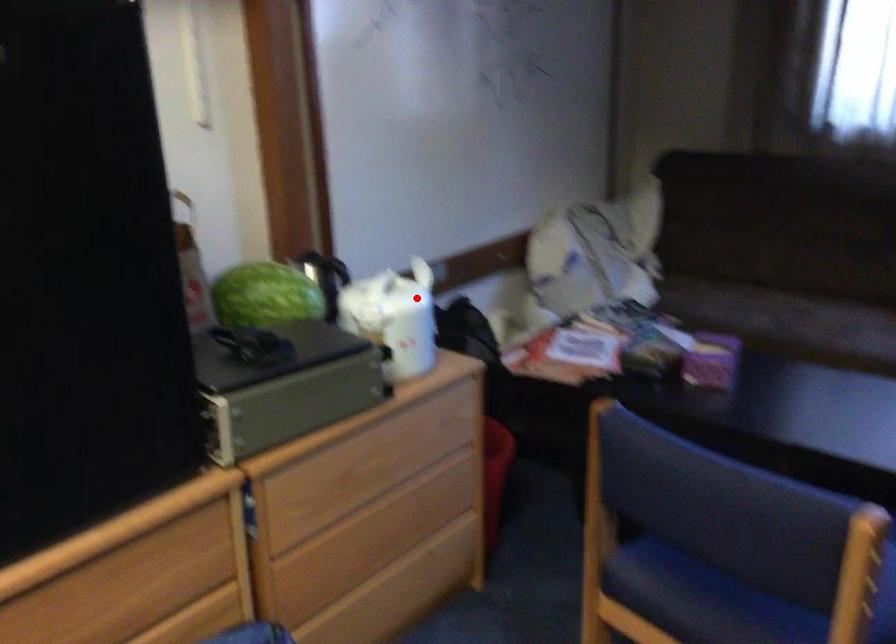
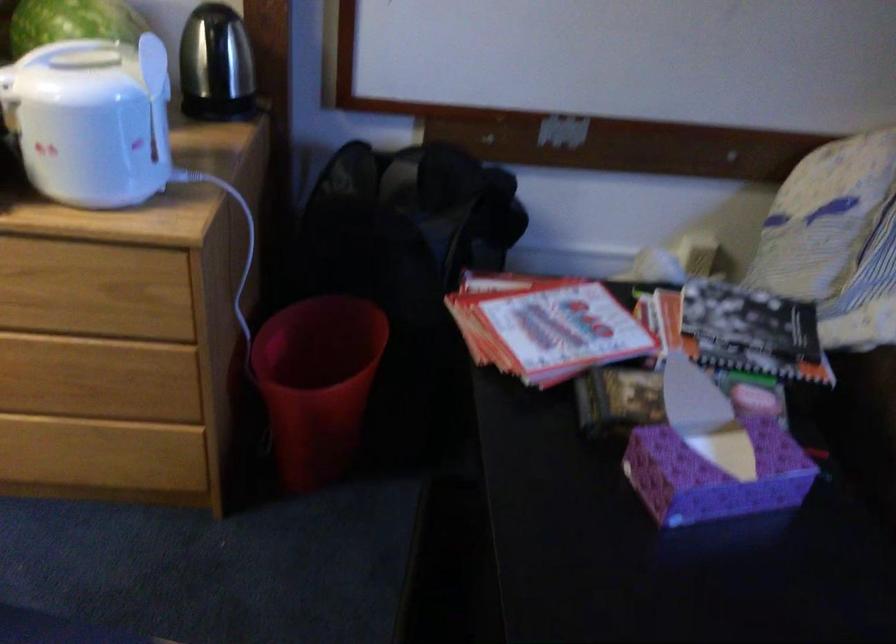
The point at the highlighted location is marked in the first image. Where is the corresponding point in the second image?

(156, 97)